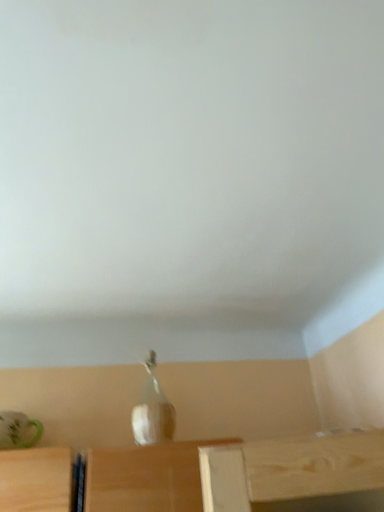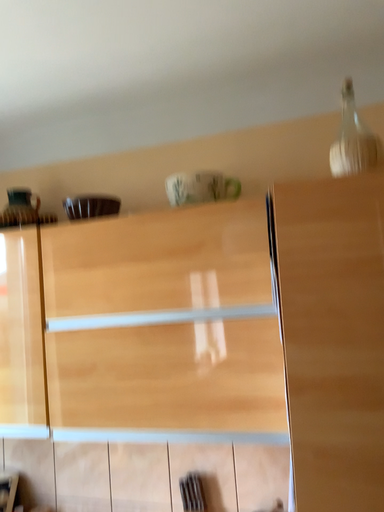
Question: Which way did the camera rotate in the video?

Choices:
 (A) rotated downward
 (B) rotated upward

Answer: (A)